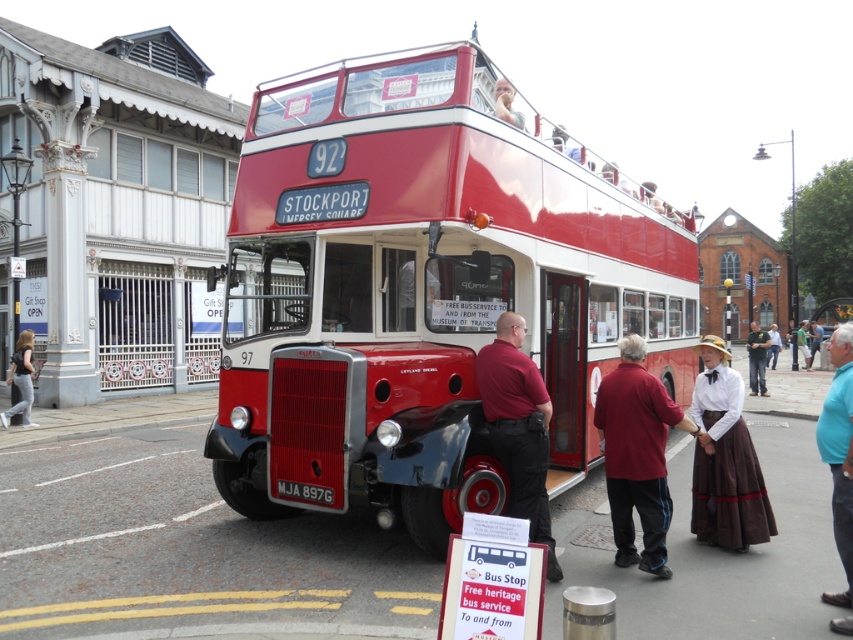
Which is more to the left, brown leather jacket at center or green fabric shirt at center?

brown leather jacket at center

Between point (759, 352) and point (805, 364), which one is positioned behind?

The point (805, 364) is more distant.

Between point (753, 387) and point (798, 332), which one is positioned in front?

Positioned in front is point (753, 387).

At what (x,y) coordinates should I click in order to perform the action: click on brown leather jacket at center. Please return your answer as a coordinate pair (x, y). The image size is (853, 640). Looking at the image, I should click on (757, 358).

Measure the distance between point (631, 541) and camera.

A distance of 5.93 meters exists between point (631, 541) and camera.

Describe the element at coordinates (637, 454) in the screenshot. I see `red cotton shirt at center` at that location.

Is point (631, 449) farther from camera compared to point (772, 360)?

No, it is in front of (772, 360).

Find the location of a particular element. red cotton shirt at center is located at coordinates (x=637, y=454).

What do you see at coordinates (518, 426) in the screenshot? This screenshot has width=853, height=640. I see `red shirt at center` at bounding box center [518, 426].

Find the location of `red shirt at center`. red shirt at center is located at coordinates (518, 426).